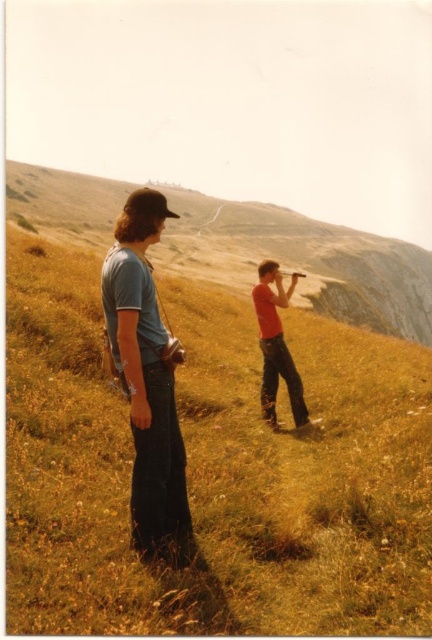
You are a drone operator trying to land a drone on the yellow grassy at center. According to the coordinates provided, where exactly should you aim the drone?

The yellow grassy at center is located at coordinates point (212, 468), so you should aim the drone there.

You are a photographer trying to capture a photo of the matte red shirt at center and the yellow grass at center. Which object is positioned higher in the frame?

The yellow grass at center is located above the matte red shirt at center, so it is positioned higher in the frame.